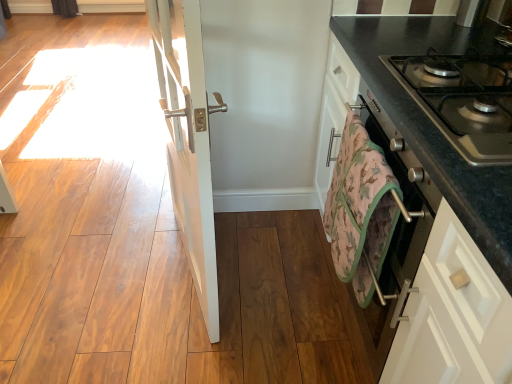
Find the location of `free space behind white glossy door at center`. free space behind white glossy door at center is located at coordinates (212, 220).